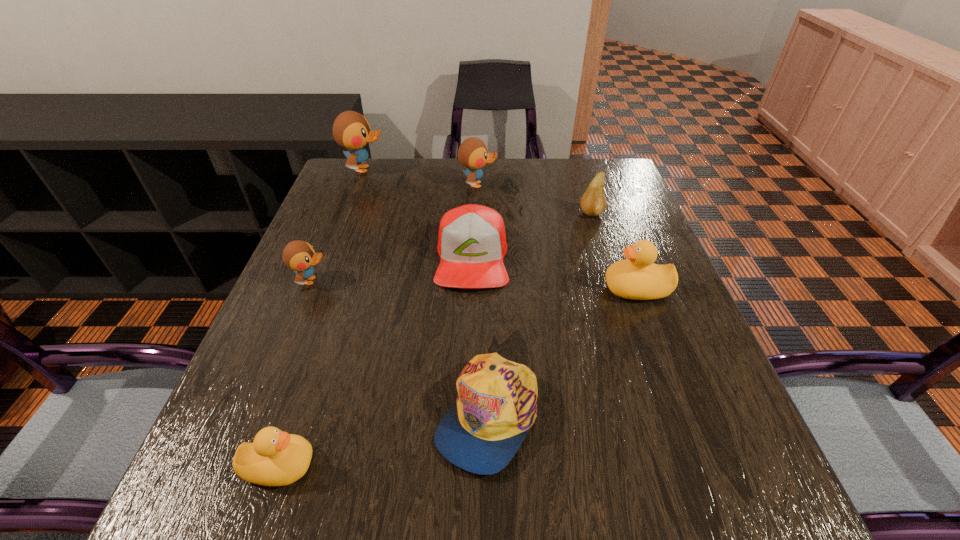
Locate an element on the screen. The width and height of the screenshot is (960, 540). vacant area that lies between the pear and the rightmost blue duck is located at coordinates (535, 199).

Locate an element on the screen. Image resolution: width=960 pixels, height=540 pixels. vacant area that lies between the nearest duck and the cap is located at coordinates (383, 440).

The image size is (960, 540). I want to click on vacant space in between the cap and the smaller yellow duck, so click(x=383, y=440).

The height and width of the screenshot is (540, 960). Identify the location of unoccupied position between the farther yellow duck and the smaller yellow duck. (458, 377).

Identify the location of object that can be found as the sixth closest to the fourth duck from left to right. (496, 405).

Point out which object is positioned as the third nearest to the third farthest object. Please provide its 2D coordinates. Your answer should be formatted as a tuple, i.e. [(x, y)], where the tuple contains the x and y coordinates of a point satisfying the conditions above.

[(472, 153)]

Point out which duck is positioned as the second nearest to the pear. Please provide its 2D coordinates. Your answer should be formatted as a tuple, i.e. [(x, y)], where the tuple contains the x and y coordinates of a point satisfying the conditions above.

[(472, 153)]

Identify the location of the closest duck relative to the third farthest object. The height and width of the screenshot is (540, 960). (x=637, y=277).

Identify which blue duck is the nearest to the smallest blue duck. Please provide its 2D coordinates. Your answer should be formatted as a tuple, i.e. [(x, y)], where the tuple contains the x and y coordinates of a point satisfying the conditions above.

[(351, 130)]

Identify which blue duck is located as the nearest to the biggest blue duck. Please provide its 2D coordinates. Your answer should be formatted as a tuple, i.e. [(x, y)], where the tuple contains the x and y coordinates of a point satisfying the conditions above.

[(472, 153)]